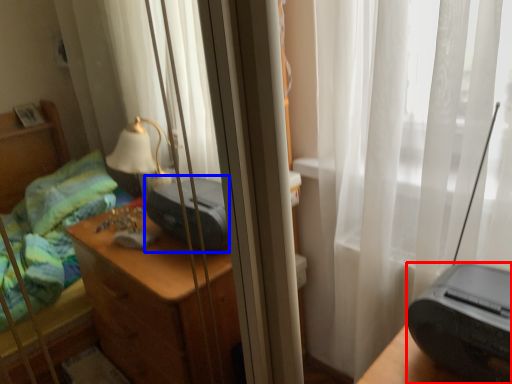
Question: Which of the following is the farthest to the observer, printer (highlighted by a red box) or printer (highlighted by a blue box)?

Choices:
 (A) printer
 (B) printer

Answer: (B)